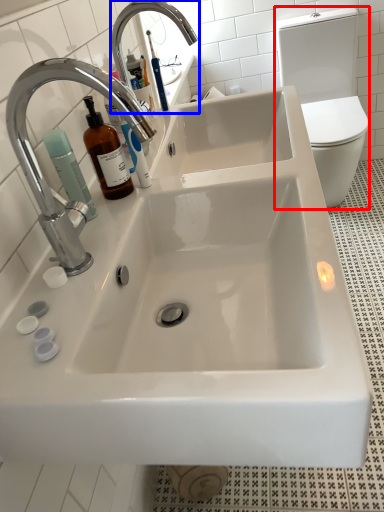
Question: Which point is closer to the camera, toilet bowl (highlighted by a red box) or tap (highlighted by a blue box)?

Choices:
 (A) toilet bowl
 (B) tap

Answer: (B)